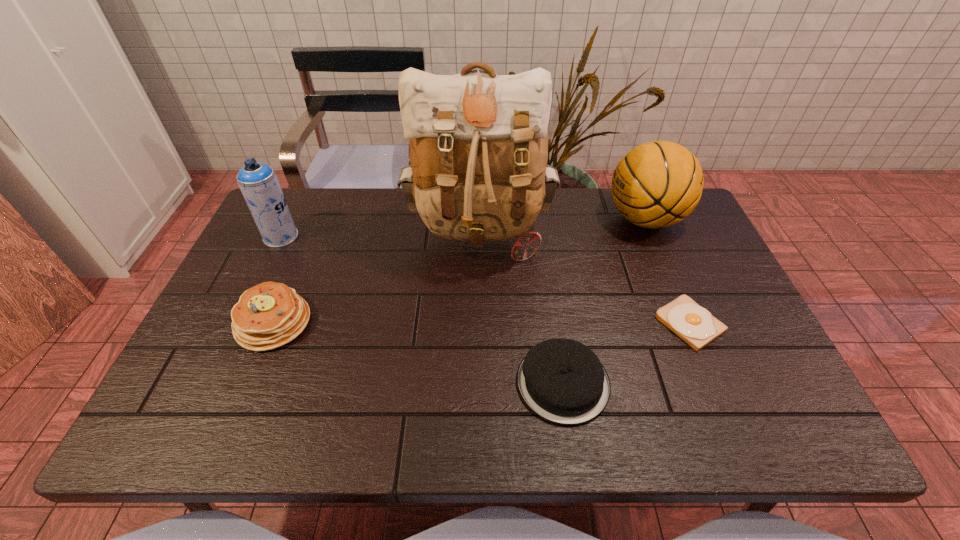
The height and width of the screenshot is (540, 960). In order to click on the tallest object in this screenshot , I will do `click(478, 141)`.

At what (x,y) coordinates should I click in order to perform the action: click on aerosol can. Please return your answer as a coordinate pair (x, y). The image size is (960, 540). Looking at the image, I should click on (258, 182).

Identify the location of basketball. (657, 184).

Locate an element on the screen. the fourth tallest object is located at coordinates (269, 315).

In order to click on the taller pancake in this screenshot , I will do `click(269, 315)`.

Where is `the right pancake`? Image resolution: width=960 pixels, height=540 pixels. the right pancake is located at coordinates (563, 381).

Where is `the fifth tallest object`? the fifth tallest object is located at coordinates (563, 381).

The height and width of the screenshot is (540, 960). In order to click on the shortest object in this screenshot , I will do `click(694, 324)`.

Locate an element on the screen. This screenshot has width=960, height=540. free region located 0.240m on the front-facing side of the tallest object is located at coordinates (479, 354).

Find the location of a particular element. This screenshot has width=960, height=540. vacant space positioned 0.070m on the back of the aerosol can is located at coordinates (293, 212).